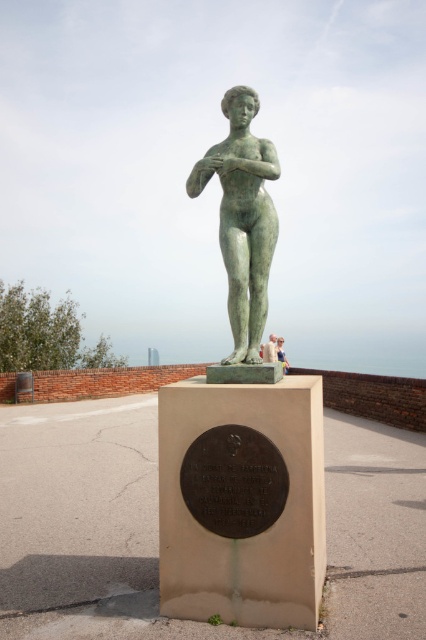
Question: Which point is closer to the camera?

Choices:
 (A) (284, 371)
 (B) (253, 352)
 (C) (276, 355)

Answer: (B)

Question: From the image, what is the correct spatial relationship of green bronze statue at center in relation to matte bronze statue at center?

Choices:
 (A) left
 (B) right

Answer: (A)

Question: Can you confirm if matte bronze statue at center is thinner than light brown wooden bench at center?

Choices:
 (A) no
 (B) yes

Answer: (A)

Question: Which point is closer to the camera?

Choices:
 (A) (278, 340)
 (B) (273, 339)
 (C) (233, 189)

Answer: (C)

Question: Does matte bronze statue at center appear under light brown wooden bench at center?

Choices:
 (A) no
 (B) yes

Answer: (A)

Question: Which of the following is the closest to the observer?

Choices:
 (A) light brown wooden bench at center
 (B) matte bronze statue at center

Answer: (B)